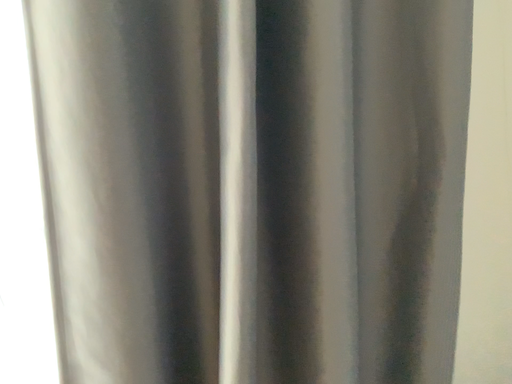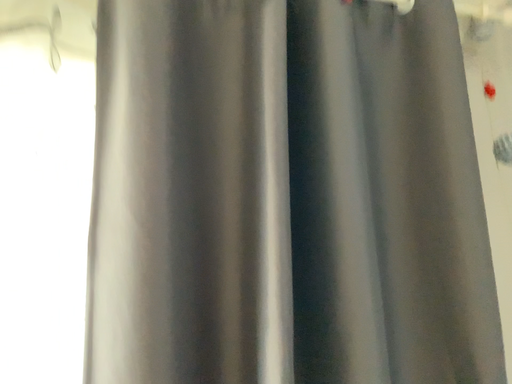
Question: How did the camera likely rotate when shooting the video?

Choices:
 (A) rotated upward
 (B) rotated downward

Answer: (A)